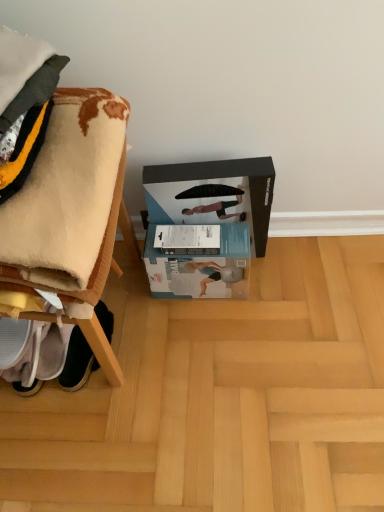
The width and height of the screenshot is (384, 512). Identify the location of vacant space in front of white cardboard box at center. (205, 335).